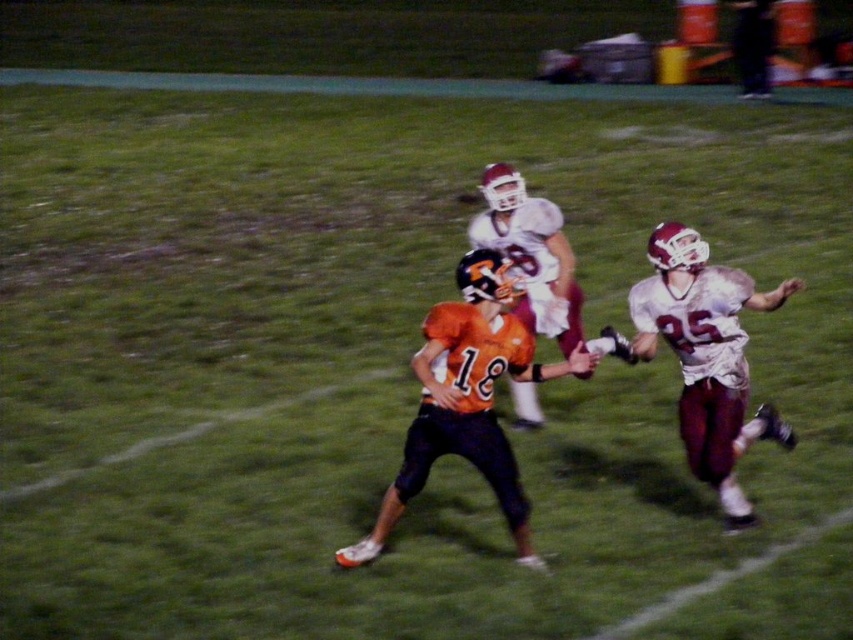
You are a referee standing at the edge of the field. You need to determine if the two players are within the required 15 feet distance for a legal play. Are the orange jersey at center and the other player within the required distance?

The two players are 18.02 feet apart, which exceeds the 15 feet requirement, so they are not within the required distance for a legal play.